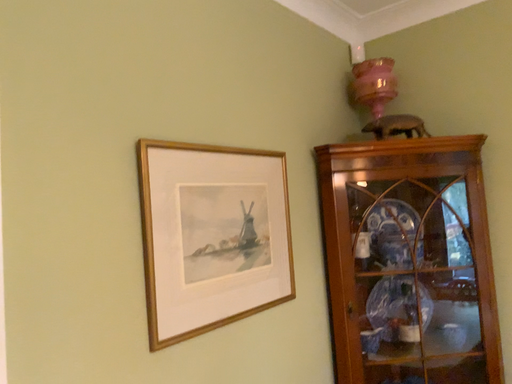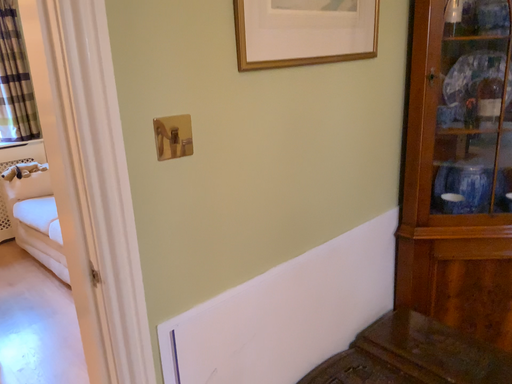
Question: How did the camera likely rotate when shooting the video?

Choices:
 (A) rotated upward
 (B) rotated downward

Answer: (B)